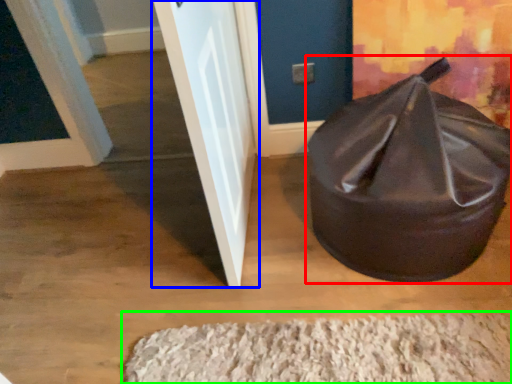
Question: Which is nearer to the bean bag chair (highlighted by a red box)? door (highlighted by a blue box) or doormat (highlighted by a green box).

Choices:
 (A) door
 (B) doormat

Answer: (B)